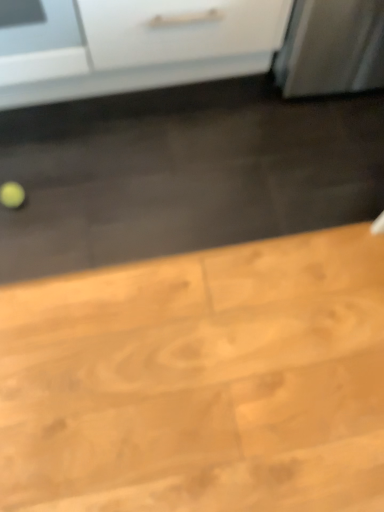
Question: From a real-world perspective, does white glossy refrigerator at upper left sit lower than wooden table at lower left?

Choices:
 (A) no
 (B) yes

Answer: (A)

Question: Is white glossy refrigerator at upper left surrounding wooden table at lower left?

Choices:
 (A) yes
 (B) no

Answer: (B)

Question: Is white glossy refrigerator at upper left at the right side of wooden table at lower left?

Choices:
 (A) yes
 (B) no

Answer: (B)

Question: Does white glossy refrigerator at upper left have a greater height compared to wooden table at lower left?

Choices:
 (A) no
 (B) yes

Answer: (B)

Question: Is white glossy refrigerator at upper left oriented towards wooden table at lower left?

Choices:
 (A) no
 (B) yes

Answer: (A)

Question: From the image's perspective, is white glossy refrigerator at upper left below wooden table at lower left?

Choices:
 (A) yes
 (B) no

Answer: (B)

Question: From the image's perspective, is wooden table at lower left located beneath white glossy refrigerator at upper left?

Choices:
 (A) yes
 (B) no

Answer: (A)

Question: Does wooden table at lower left touch white glossy refrigerator at upper left?

Choices:
 (A) yes
 (B) no

Answer: (B)

Question: Is the position of wooden table at lower left less distant than that of white glossy refrigerator at upper left?

Choices:
 (A) yes
 (B) no

Answer: (A)

Question: From the image's perspective, does wooden table at lower left appear higher than white glossy refrigerator at upper left?

Choices:
 (A) no
 (B) yes

Answer: (A)

Question: Can you confirm if wooden table at lower left is bigger than white glossy refrigerator at upper left?

Choices:
 (A) yes
 (B) no

Answer: (B)

Question: Does wooden table at lower left have a lesser width compared to white glossy refrigerator at upper left?

Choices:
 (A) yes
 (B) no

Answer: (B)

Question: Visually, is wooden table at lower left positioned to the left or to the right of white glossy refrigerator at upper left?

Choices:
 (A) right
 (B) left

Answer: (A)